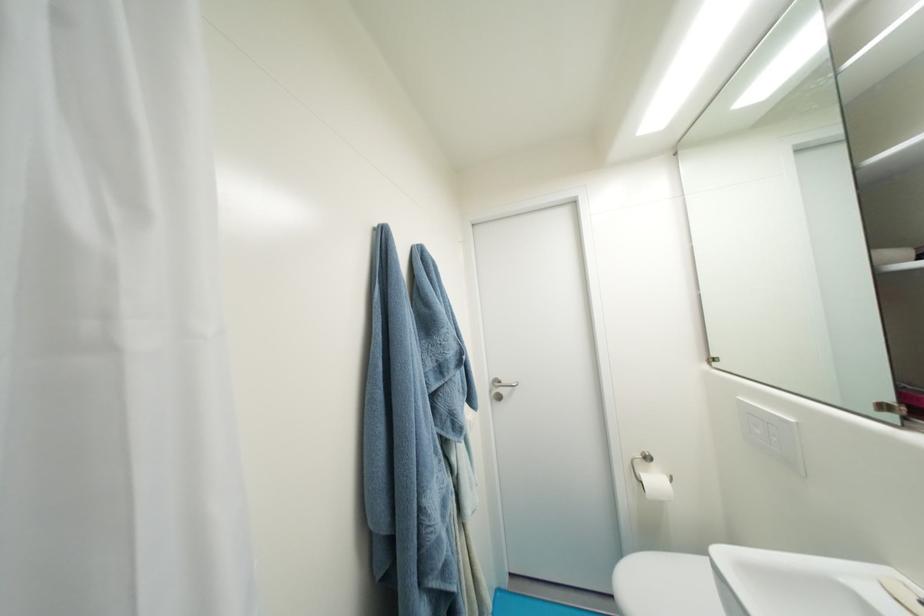
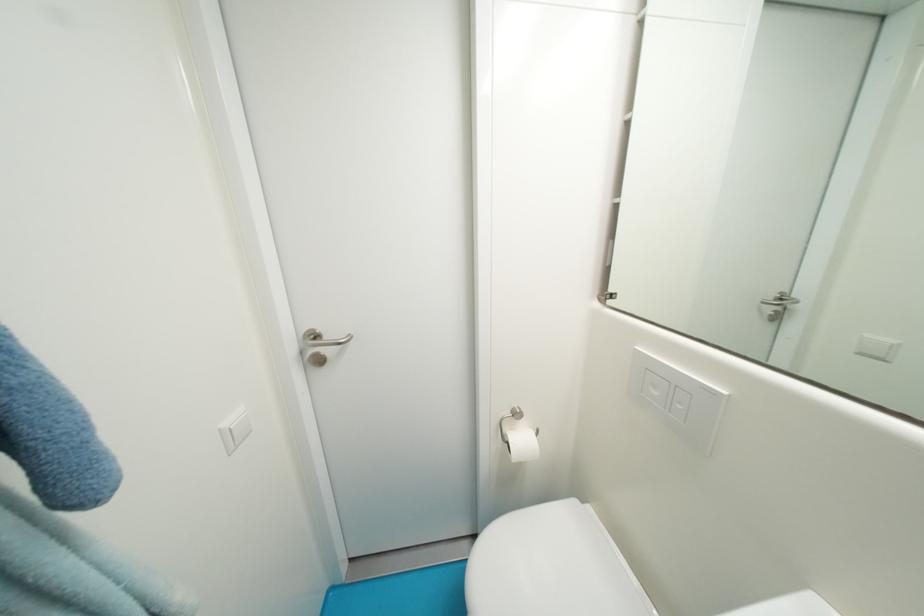
The point at (x=662, y=482) is marked in the first image. Where is the corresponding point in the second image?

(529, 442)